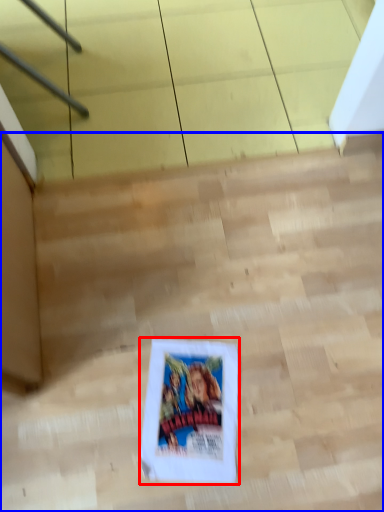
Question: Which of the following is the farthest to the observer, comic book (highlighted by a red box) or stairwell (highlighted by a blue box)?

Choices:
 (A) comic book
 (B) stairwell

Answer: (A)